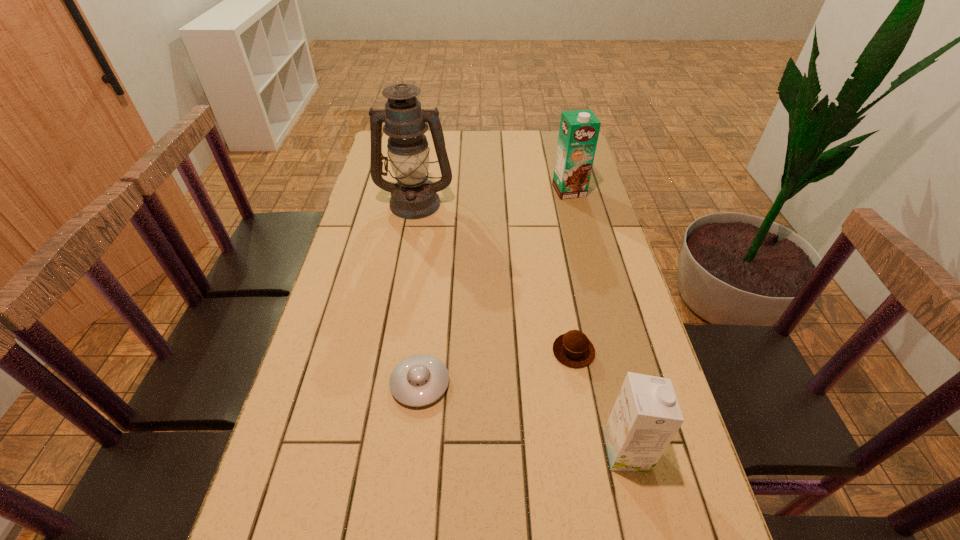
You are a GUI agent. You are given a task and a screenshot of the screen. Output one action in this format:
    pyautogui.click(x=<x>, y=<y>)
    Task: Click on the vacant point located between the second shortest object and the shorter carton
    This screenshot has width=960, height=540.
    Given the screenshot: What is the action you would take?
    point(600,401)

Locate an element on the screen. The image size is (960, 540). free space between the second shortest object and the tallest object is located at coordinates (494, 276).

Where is `vacant area that lies between the shorter carton and the shortest object`? The height and width of the screenshot is (540, 960). vacant area that lies between the shorter carton and the shortest object is located at coordinates (523, 417).

Find the location of a particular element. vacant area that lies between the farther carton and the saucer is located at coordinates (494, 287).

I want to click on free area in between the tallest object and the muffin, so click(x=494, y=276).

This screenshot has width=960, height=540. I want to click on vacant area that lies between the oil lamp and the muffin, so click(x=494, y=276).

You are a GUI agent. You are given a task and a screenshot of the screen. Output one action in this format:
    pyautogui.click(x=<x>, y=<y>)
    Task: Click on the vacant area that lies between the farther carton and the tallest object
    
    Given the screenshot: What is the action you would take?
    pyautogui.click(x=492, y=197)

Identify which object is located as the fourth nearest to the nearer carton. Please provide its 2D coordinates. Your answer should be formatted as a tuple, i.e. [(x, y)], where the tuple contains the x and y coordinates of a point satisfying the conditions above.

[(578, 134)]

The width and height of the screenshot is (960, 540). In order to click on object that stands as the fourth closest to the shortest object in this screenshot , I will do `click(578, 134)`.

This screenshot has height=540, width=960. In order to click on vacant space that satisfies the following two spatial constraints: 1. on the front side of the fourth tallest object; 2. on the right side of the shorter carton in this screenshot , I will do `click(591, 451)`.